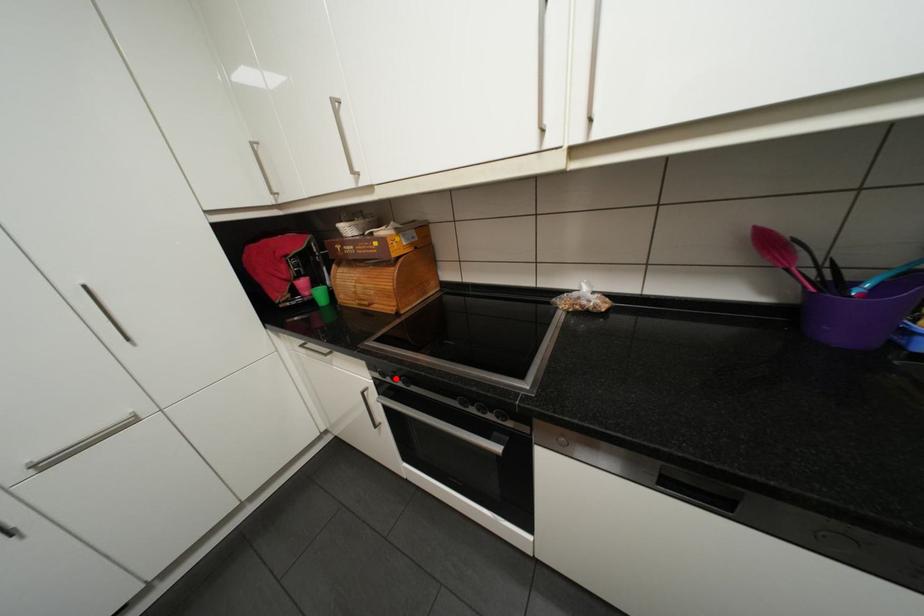
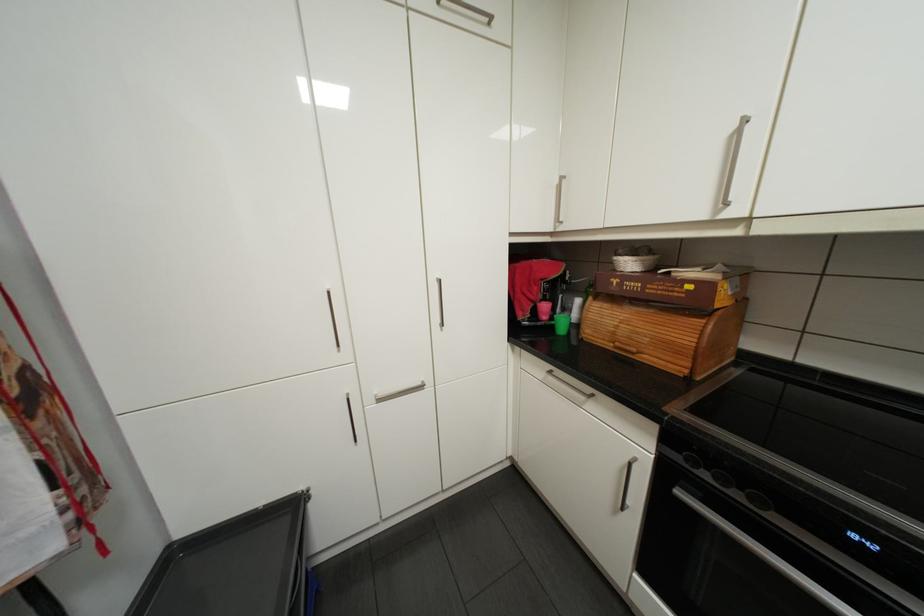
Where in the second image is the point corresponding to the highlighted location from the first image?

(712, 474)